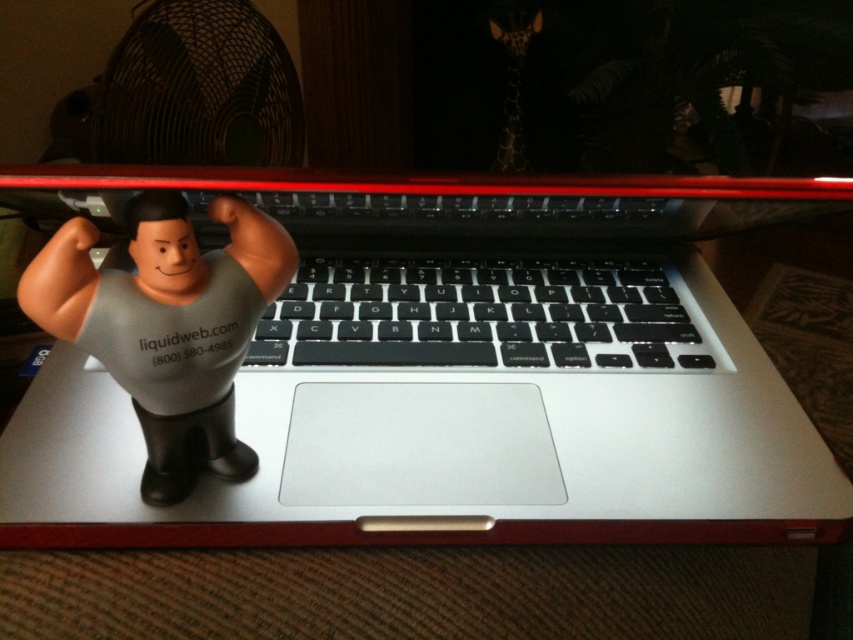
Does rubber/soft toy at left come behind spotted fur giraffe at upper center?

No, it is in front of spotted fur giraffe at upper center.

Is rubber/soft toy at left bigger than spotted fur giraffe at upper center?

Incorrect, rubber/soft toy at left is not larger than spotted fur giraffe at upper center.

Find the location of a particular element. rubber/soft toy at left is located at coordinates (167, 324).

In order to click on rubber/soft toy at left in this screenshot , I will do `click(167, 324)`.

Does silver metallic laptop at center have a smaller size compared to spotted fur giraffe at upper center?

Incorrect, silver metallic laptop at center is not smaller in size than spotted fur giraffe at upper center.

Does point (375, 477) come farther from viewer compared to point (515, 28)?

No, it is not.

Is point (263, 465) positioned before point (519, 164)?

Yes, point (263, 465) is closer to viewer.

In order to click on silver metallic laptop at center in this screenshot , I will do `click(451, 372)`.

Locate an element on the screen. This screenshot has height=640, width=853. black matte keyboard at center is located at coordinates pyautogui.click(x=485, y=317).

Between black matte keyboard at center and spotted fur giraffe at upper center, which one is positioned higher?

spotted fur giraffe at upper center is above.

Is point (378, 301) behind point (509, 12)?

No.

At what (x,y) coordinates should I click in order to perform the action: click on black matte keyboard at center. Please return your answer as a coordinate pair (x, y). Image resolution: width=853 pixels, height=640 pixels. Looking at the image, I should click on (485, 317).